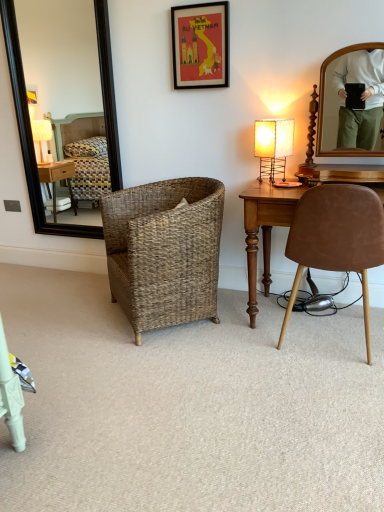
Question: In the image, is black framed mirror at left positioned in front of or behind woven basket at center?

Choices:
 (A) front
 (B) behind

Answer: (B)

Question: Is black framed mirror at left inside the boundaries of woven basket at center, or outside?

Choices:
 (A) outside
 (B) inside

Answer: (A)

Question: Which is nearer to the red paper picture frame at upper center?

Choices:
 (A) brown suede chair at right, the 2th chair when ordered from left to right
 (B) woven basket at center
 (C) woven brown basket at center, which ranks as the second chair in right-to-left order
 (D) black framed mirror at left
 (E) matte beige lamp at right

Answer: (E)

Question: Which of these objects is positioned farthest from the black framed mirror at left?

Choices:
 (A) woven brown basket at center, which ranks as the second chair in right-to-left order
 (B) brown suede chair at right, arranged as the first chair when viewed from the right
 (C) red paper picture frame at upper center
 (D) matte beige lamp at right
 (E) woven basket at center

Answer: (B)